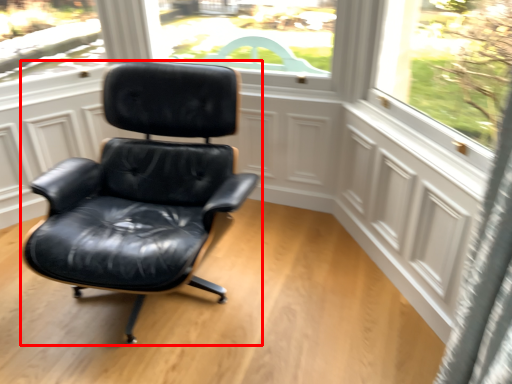
Question: Observing the image, what is the correct spatial positioning of chair (annotated by the red box) in reference to screen door?

Choices:
 (A) left
 (B) right

Answer: (A)